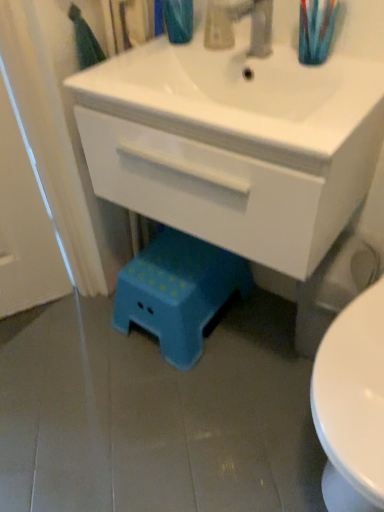
What is the approximate width of white glossy cabinet at center?

The width of white glossy cabinet at center is 16.33 inches.

I want to click on blue plastic step stool at lower center, so click(x=178, y=292).

What do you see at coordinates (178, 292) in the screenshot? I see `blue plastic step stool at lower center` at bounding box center [178, 292].

Measure the distance between metallic silver faucet at upper center and camera.

metallic silver faucet at upper center and camera are 34.43 inches apart.

What is the approximate width of metallic silver faucet at upper center?

19.48 centimeters.

Find the location of a particular element. The width and height of the screenshot is (384, 512). translucent plastic soap dispenser at upper center is located at coordinates (218, 29).

Locate an element on the screen. white glossy cabinet at center is located at coordinates (241, 136).

Considering the points (174, 238) and (206, 20), which point is behind, point (174, 238) or point (206, 20)?

The point (174, 238) is behind.

Looking at this image, which is in front, blue plastic step stool at lower center or translucent plastic soap dispenser at upper center?

translucent plastic soap dispenser at upper center is closer to the camera.

From a real-world perspective, who is located lower, blue plastic step stool at lower center or translucent plastic soap dispenser at upper center?

blue plastic step stool at lower center, from a real-world perspective.

Choose the correct answer: Is blue plastic step stool at lower center inside translucent plastic soap dispenser at upper center or outside it?

Answer: blue plastic step stool at lower center cannot be found inside translucent plastic soap dispenser at upper center.

Who is taller, translucent plastic soap dispenser at upper center or translucent plastic toothbrush at upper right?

translucent plastic toothbrush at upper right is taller.

Is translucent plastic soap dispenser at upper center smaller than translucent plastic toothbrush at upper right?

Actually, translucent plastic soap dispenser at upper center might be larger than translucent plastic toothbrush at upper right.

From the image's perspective, is translucent plastic soap dispenser at upper center located above or below translucent plastic toothbrush at upper right?

Based on their image positions, translucent plastic soap dispenser at upper center is located above translucent plastic toothbrush at upper right.

Which is behind, point (211, 26) or point (318, 58)?

Positioned behind is point (211, 26).

Where is `tap that is on the right side of teal plastic stool at lower center`? The width and height of the screenshot is (384, 512). tap that is on the right side of teal plastic stool at lower center is located at coordinates (254, 23).

Who is taller, metallic silver faucet at upper center or teal plastic stool at lower center?

With more height is teal plastic stool at lower center.

Is the position of metallic silver faucet at upper center less distant than that of teal plastic stool at lower center?

Yes, it is in front of teal plastic stool at lower center.

How many degrees apart are the facing directions of metallic silver faucet at upper center and teal plastic stool at lower center?

The facing directions of metallic silver faucet at upper center and teal plastic stool at lower center are 2.27 degrees apart.

Relative to blue plastic step stool at lower center, is translucent plastic toothbrush at upper right in front or behind?

translucent plastic toothbrush at upper right is in front of blue plastic step stool at lower center.

Is translucent plastic toothbrush at upper right positioned with its back to blue plastic step stool at lower center?

translucent plastic toothbrush at upper right does not have its back to blue plastic step stool at lower center.

How many degrees apart are the facing directions of translucent plastic toothbrush at upper right and blue plastic step stool at lower center?

2.88 degrees.

Which is more to the left, translucent plastic toothbrush at upper right or blue plastic step stool at lower center?

From the viewer's perspective, blue plastic step stool at lower center appears more on the left side.

Could you measure the distance between translucent plastic toothbrush at upper right and white glossy cabinet at center?

translucent plastic toothbrush at upper right and white glossy cabinet at center are 28.90 centimeters apart.

From the image's perspective, is translucent plastic toothbrush at upper right on top of white glossy cabinet at center?

Yes.

Based on the photo, from a real-world perspective, which object rests below the other?

white glossy cabinet at center is physically lower.

Is point (305, 58) closer or farther from the camera than point (298, 68)?

Point (305, 58) is positioned closer to the camera compared to point (298, 68).

Considering the positions of objects translucent plastic toothbrush at upper right and teal plastic stool at lower center in the image provided, who is more to the left, translucent plastic toothbrush at upper right or teal plastic stool at lower center?

Positioned to the left is teal plastic stool at lower center.

Where is `toothbrush on the right of teal plastic stool at lower center`? This screenshot has height=512, width=384. toothbrush on the right of teal plastic stool at lower center is located at coordinates (316, 30).

Who is taller, translucent plastic toothbrush at upper right or teal plastic stool at lower center?

Standing taller between the two is teal plastic stool at lower center.

From the image's perspective, is translucent plastic toothbrush at upper right located above or below teal plastic stool at lower center?

translucent plastic toothbrush at upper right is situated lower than teal plastic stool at lower center in the image.

Would you say teal plastic stool at lower center is a long distance from white glossy cabinet at center?

Actually, teal plastic stool at lower center and white glossy cabinet at center are a little close together.

Considering the relative sizes of teal plastic stool at lower center and white glossy cabinet at center in the image provided, is teal plastic stool at lower center taller than white glossy cabinet at center?

Incorrect, the height of teal plastic stool at lower center is not larger of that of white glossy cabinet at center.

Does teal plastic stool at lower center have a larger size compared to white glossy cabinet at center?

No, teal plastic stool at lower center is not bigger than white glossy cabinet at center.

Which object is positioned more to the right, teal plastic stool at lower center or white glossy cabinet at center?

white glossy cabinet at center.

The width and height of the screenshot is (384, 512). I want to click on step stool below the translucent plastic soap dispenser at upper center (from the image's perspective), so click(x=178, y=292).

Image resolution: width=384 pixels, height=512 pixels. I want to click on toothbrush in front of the translucent plastic soap dispenser at upper center, so (x=316, y=30).

Which object lies further to the anchor point translucent plastic soap dispenser at upper center, blue plastic step stool at lower center or teal plastic stool at lower center?

→ blue plastic step stool at lower center lies further to translucent plastic soap dispenser at upper center than the other object.

Looking at the image, which one is located closer to teal plastic stool at lower center, white glossy cabinet at center or blue plastic step stool at lower center?

The object closer to teal plastic stool at lower center is white glossy cabinet at center.

Considering their positions, is translucent plastic toothbrush at upper right positioned closer to translucent plastic soap dispenser at upper center than blue plastic step stool at lower center?

translucent plastic toothbrush at upper right lies closer to translucent plastic soap dispenser at upper center than the other object.

Looking at the image, which one is located closer to translucent plastic toothbrush at upper right, blue plastic step stool at lower center or white glossy cabinet at center?

Among the two, white glossy cabinet at center is located nearer to translucent plastic toothbrush at upper right.

Which object lies nearer to the anchor point metallic silver faucet at upper center, teal plastic stool at lower center or translucent plastic toothbrush at upper right?

translucent plastic toothbrush at upper right is closer to metallic silver faucet at upper center.

From the image, which object appears to be farther from metallic silver faucet at upper center, translucent plastic toothbrush at upper right or blue plastic step stool at lower center?

blue plastic step stool at lower center is positioned further to the anchor metallic silver faucet at upper center.

Based on their spatial positions, is blue plastic step stool at lower center or translucent plastic toothbrush at upper right further from metallic silver faucet at upper center?

Answer: blue plastic step stool at lower center is further to metallic silver faucet at upper center.

Which object lies nearer to the anchor point blue plastic step stool at lower center, translucent plastic toothbrush at upper right or white glossy cabinet at center?

white glossy cabinet at center is closer to blue plastic step stool at lower center.

Identify the location of bathroom cabinet between translucent plastic toothbrush at upper right and blue plastic step stool at lower center from top to bottom. click(241, 136).

Where is `tap that lies between translucent plastic soap dispenser at upper center and blue plastic step stool at lower center from top to bottom`? The image size is (384, 512). tap that lies between translucent plastic soap dispenser at upper center and blue plastic step stool at lower center from top to bottom is located at coordinates (254, 23).

Locate an element on the screen. toothbrush between translucent plastic soap dispenser at upper center and blue plastic step stool at lower center from top to bottom is located at coordinates (316, 30).

Locate an element on the screen. tap between teal plastic stool at lower center and white glossy cabinet at center in the up-down direction is located at coordinates (254, 23).